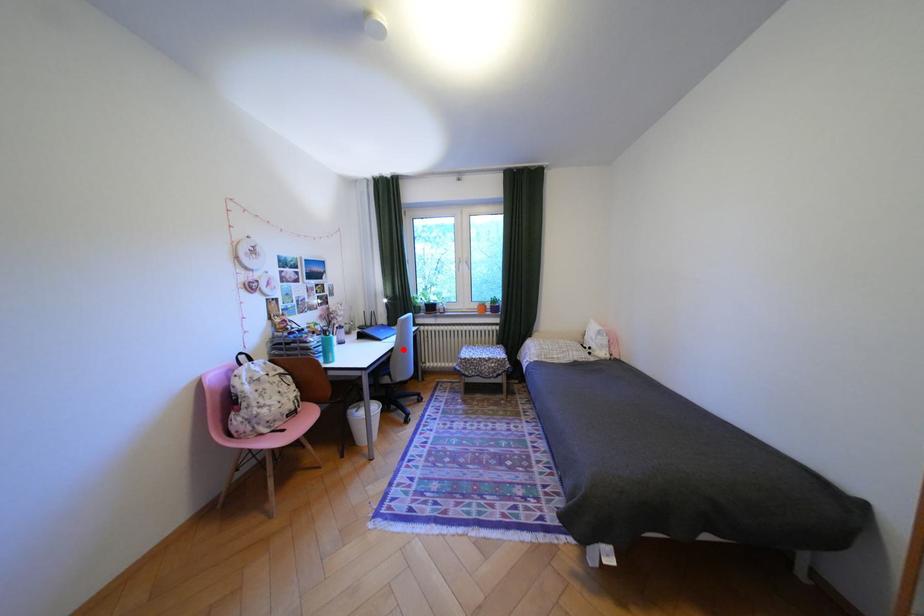
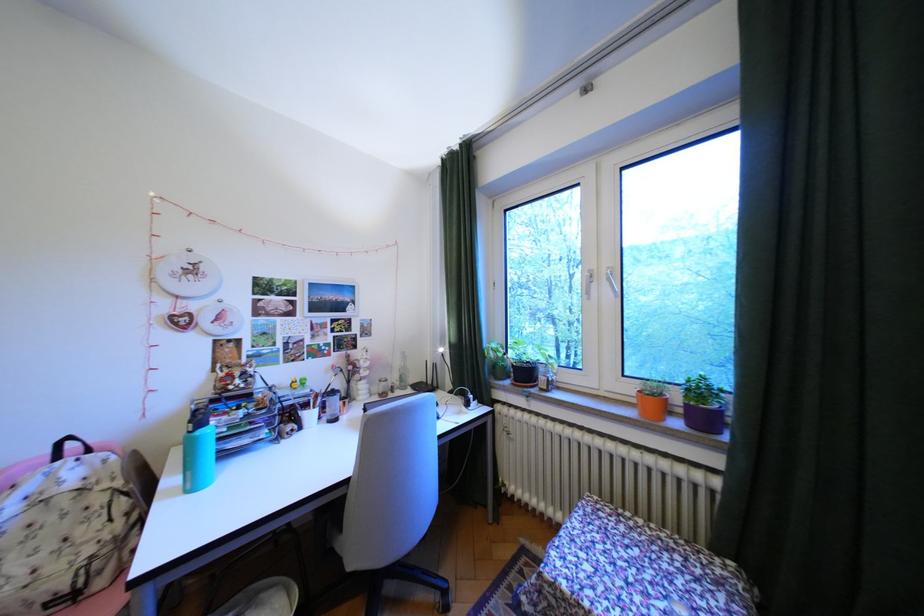
Question: I am providing you with two images of the same scene from different viewpoints. A red point is shown in image1. For the corresponding object point in image2, is it positioned nearer or farther from the camera?

Choices:
 (A) Nearer
 (B) Farther

Answer: (B)